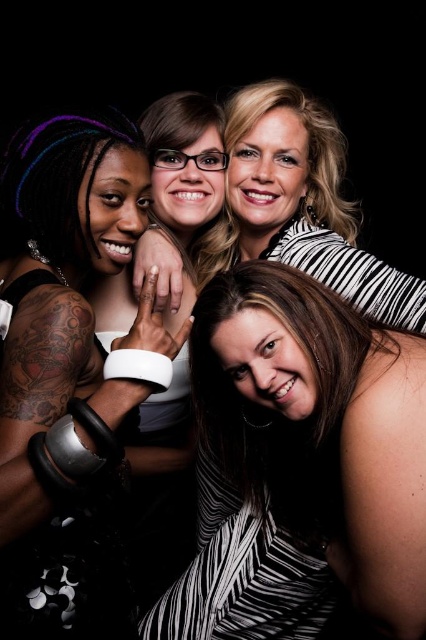
Question: Can you confirm if striped fabric dress at lower right is thinner than matte black dress at left?

Choices:
 (A) yes
 (B) no

Answer: (B)

Question: Considering the relative positions of striped fabric dress at lower right and matte black dress at left in the image provided, where is striped fabric dress at lower right located with respect to matte black dress at left?

Choices:
 (A) above
 (B) below

Answer: (B)

Question: Among these objects, which one is nearest to the camera?

Choices:
 (A) matte black dress at left
 (B) striped fabric dress at lower right

Answer: (A)

Question: Which of the following is the farthest from the observer?

Choices:
 (A) striped fabric dress at lower right
 (B) matte black dress at left

Answer: (A)

Question: Can you confirm if striped fabric dress at lower right is wider than matte black dress at left?

Choices:
 (A) no
 (B) yes

Answer: (B)